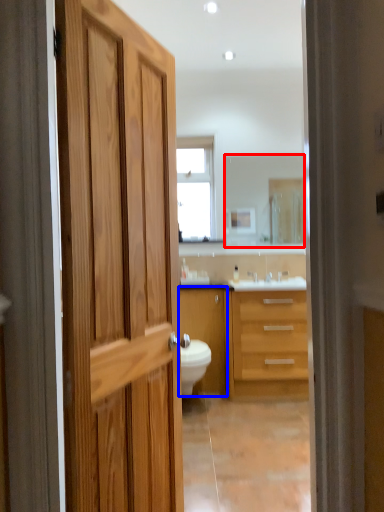
Question: Which object is further to the camera taking this photo, mirror (highlighted by a red box) or cabinetry (highlighted by a blue box)?

Choices:
 (A) mirror
 (B) cabinetry

Answer: (A)